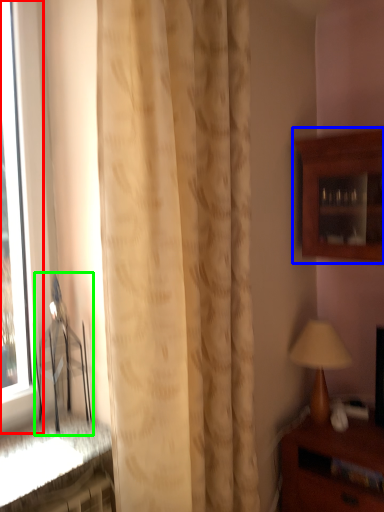
Question: Based on their relative distances, which object is farther from window (highlighted by a red box)? Choose from cabinetry (highlighted by a blue box) and chair (highlighted by a green box).

Choices:
 (A) cabinetry
 (B) chair

Answer: (A)